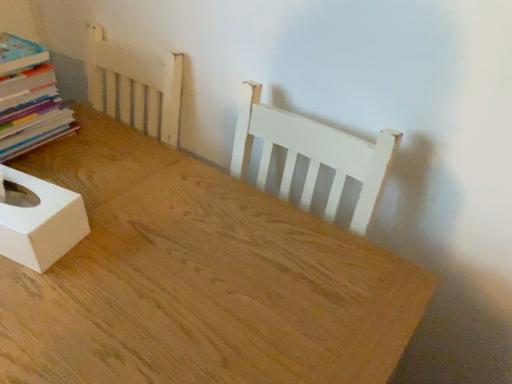
This screenshot has width=512, height=384. Identify the location of free spot above natural wood table at center (from a real-world perspective). (149, 221).